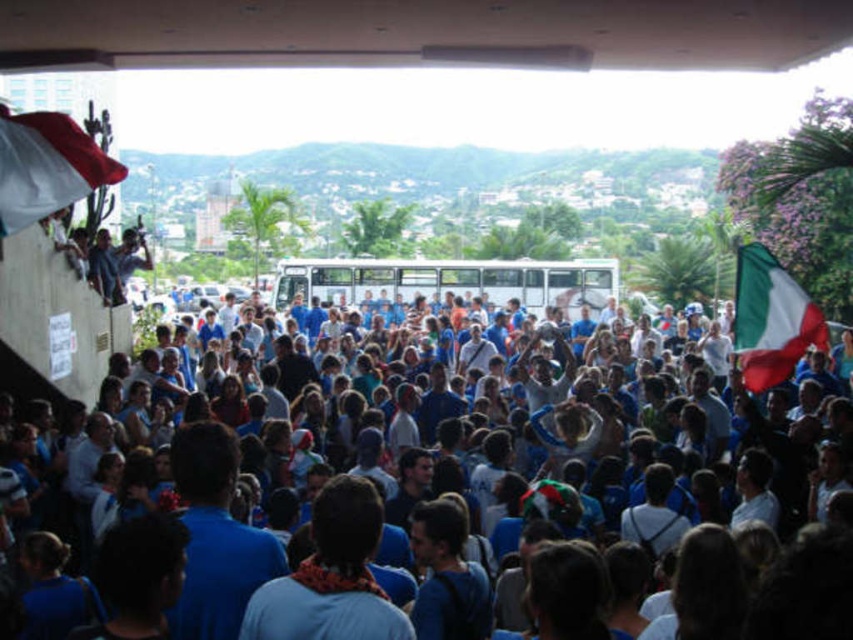
You are a photographer at the event and want to capture the blue fabric crowd at center and the white fabric flag at upper left in the same frame. Based on their positions, will the flag be visible above the crowd?

The blue fabric crowd at center is positioned under the white fabric flag at upper left, so yes, the flag will be visible above the crowd.

In the scene shown: You are a photographer trying to capture a photo of the green and white fabric flag at right without the blue fabric crowd at center blocking it. Based on the scene, is there a position you can stand where the flag is visible without the crowd blocking it?

The blue fabric crowd at center is taller than the green and white fabric flag at right, so standing behind the crowd or at a lower angle might allow the flag to be visible without obstruction.